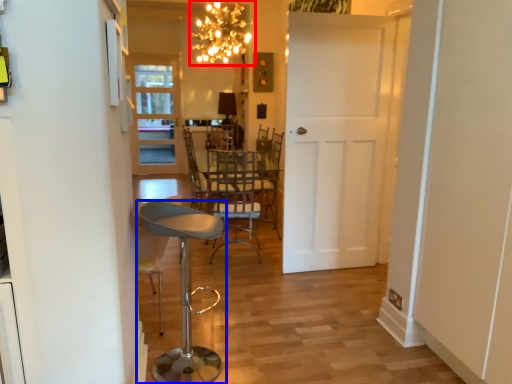
Question: Which of the following is the farthest to the observer, lamp (highlighted by a red box) or stool (highlighted by a blue box)?

Choices:
 (A) lamp
 (B) stool

Answer: (A)